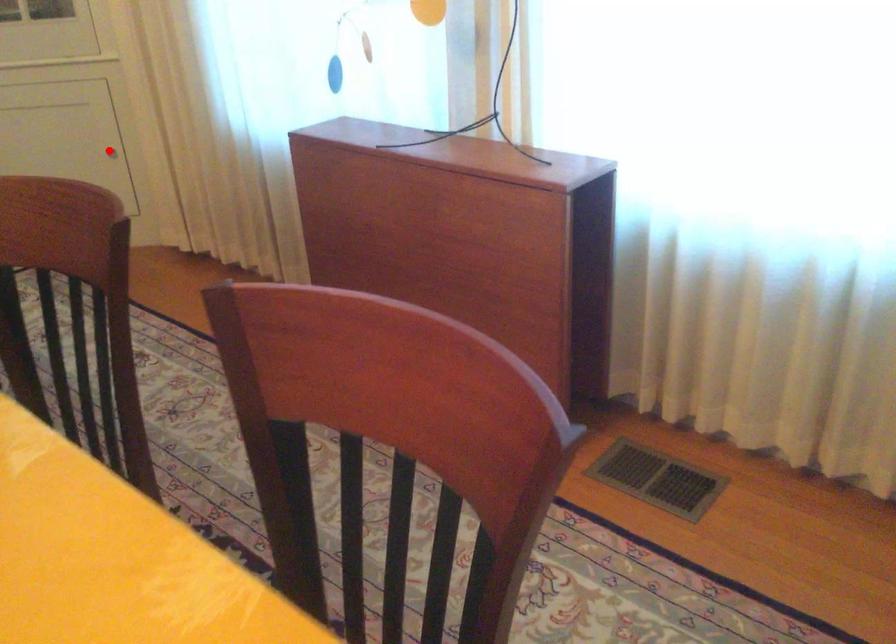
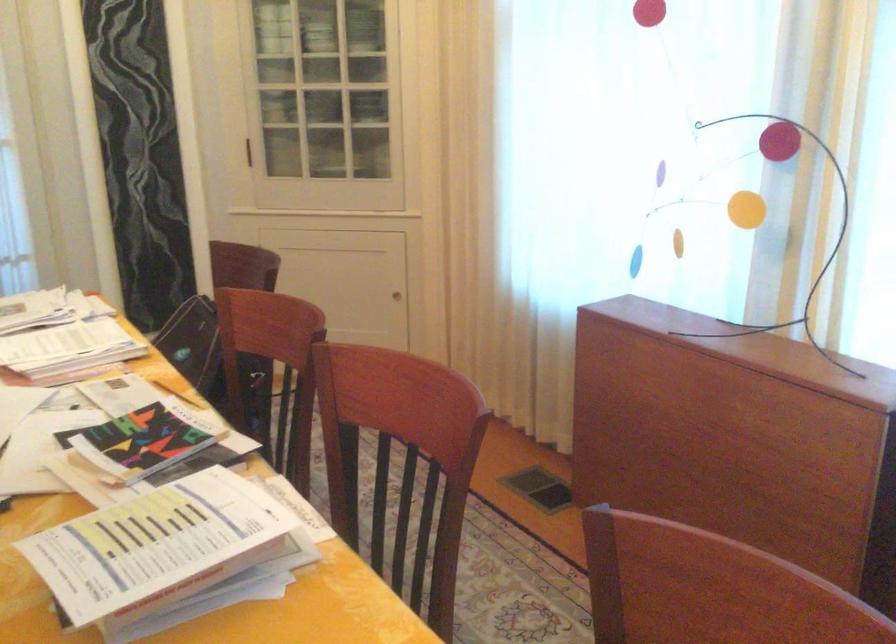
Question: I am providing you with two images of the same scene from different viewpoints. Image1 has a red point marked. In image2, the corresponding 3D location appears at what relative position? Reply with the corresponding letter.

Choices:
 (A) Closer
 (B) Farther

Answer: (B)